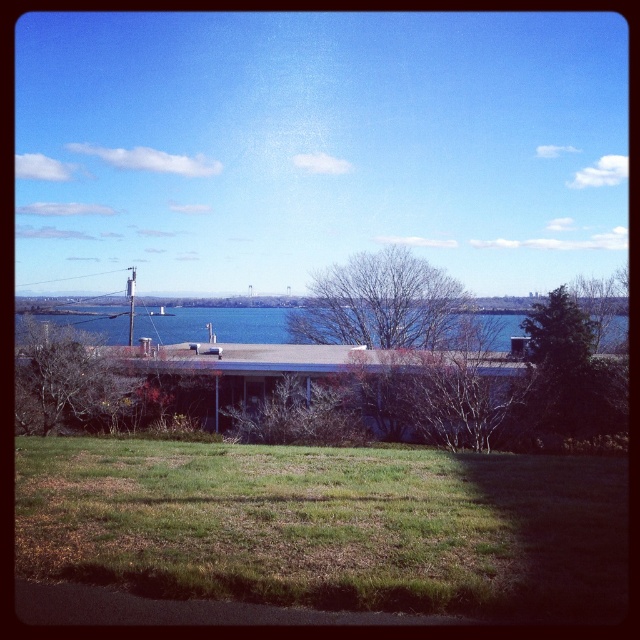
You are standing at the edge of the paved road in the foreground and want to walk towards the blue water at center. Which direction should you head to avoid the bare branches at center?

You should head to the left side of blue water at center since the bare branches at center is on the right side of it, so moving left would avoid them.

You are standing on the paved road in the foreground and want to look at the green leafy tree at upper right and the blue water at center. Which object is closer to your eye level when you look straight ahead?

The green leafy tree at upper right is closer to your eye level than the blue water at center because it is positioned below the blue water at center in the image.